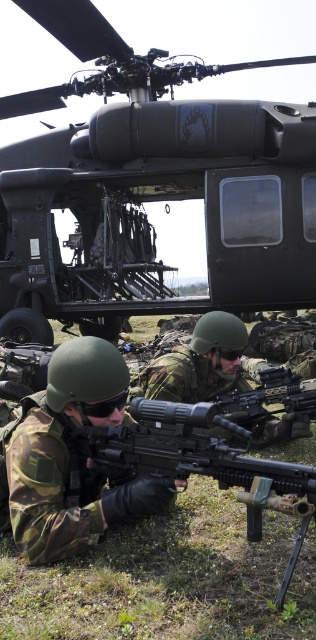
Based on the photo, is camo fabric rifle at center thinner than camouflage uniform at center?

Indeed, camo fabric rifle at center has a lesser width compared to camouflage uniform at center.

Consider the image. Who is more distant from viewer, (89,470) or (229,360)?

Positioned behind is point (229,360).

Image resolution: width=316 pixels, height=640 pixels. What do you see at coordinates (72, 456) in the screenshot?
I see `camo fabric rifle at center` at bounding box center [72, 456].

Identify the location of camo fabric rifle at center. (72, 456).

Is camo fabric rifle at center above matte black rifle at center?

Indeed, camo fabric rifle at center is positioned over matte black rifle at center.

Does camo fabric rifle at center have a lesser height compared to matte black rifle at center?

No.

Identify the location of camo fabric rifle at center. This screenshot has height=640, width=316. (72, 456).

Who is more forward, [293,164] or [207,448]?

Point [207,448] is in front.

Which is more to the right, matte black helicopter at center or matte black rifle at center?

Positioned to the right is matte black rifle at center.

Is point (55, 268) positioned behind point (73, 476)?

Yes.

You are a GUI agent. You are given a task and a screenshot of the screen. Output one action in this format:
    pyautogui.click(x=<x>, y=<y>)
    Task: Click on the matte black helicopter at center
    
    Given the screenshot: What is the action you would take?
    pyautogui.click(x=150, y=188)